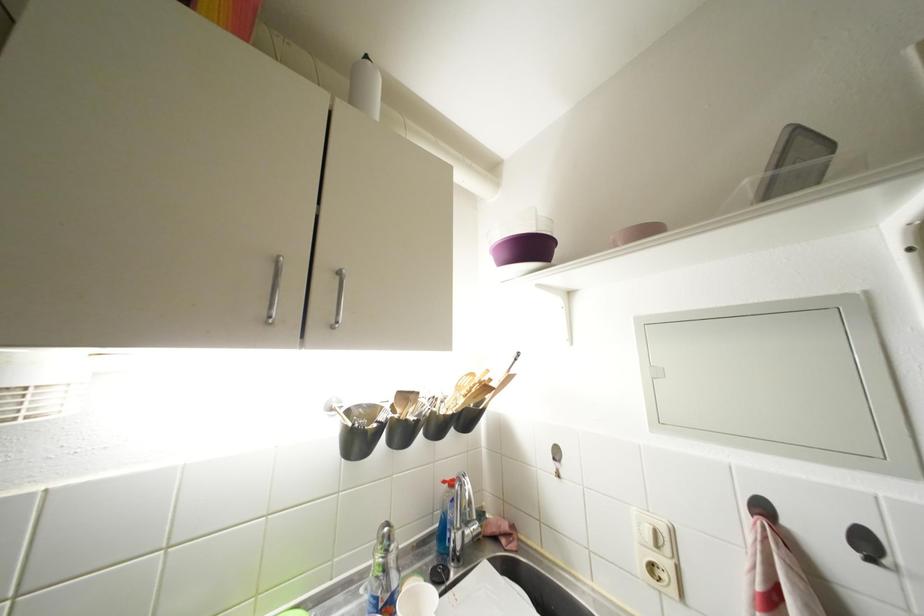
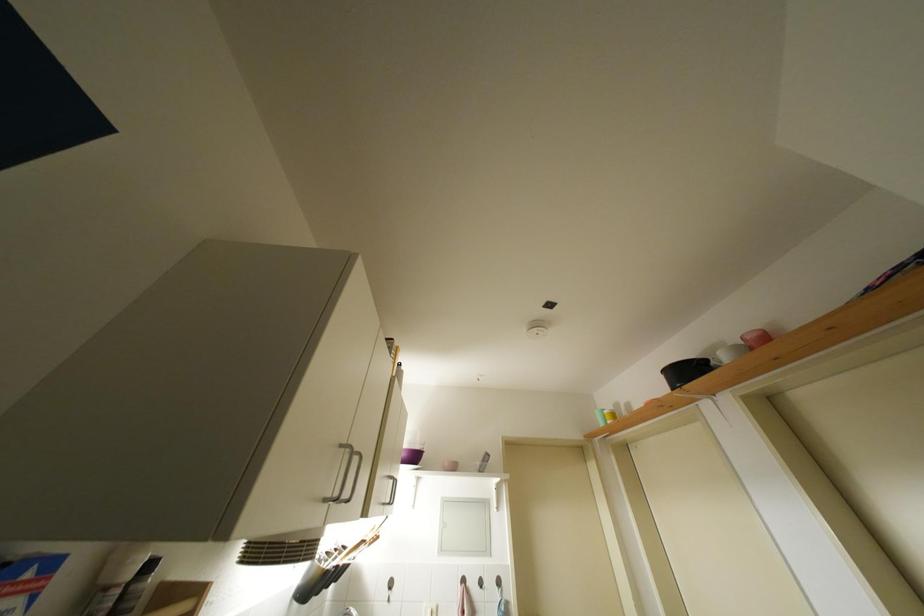
Locate, in the second image, the point that corresponds to pixel 666 427 in the first image.

(447, 554)